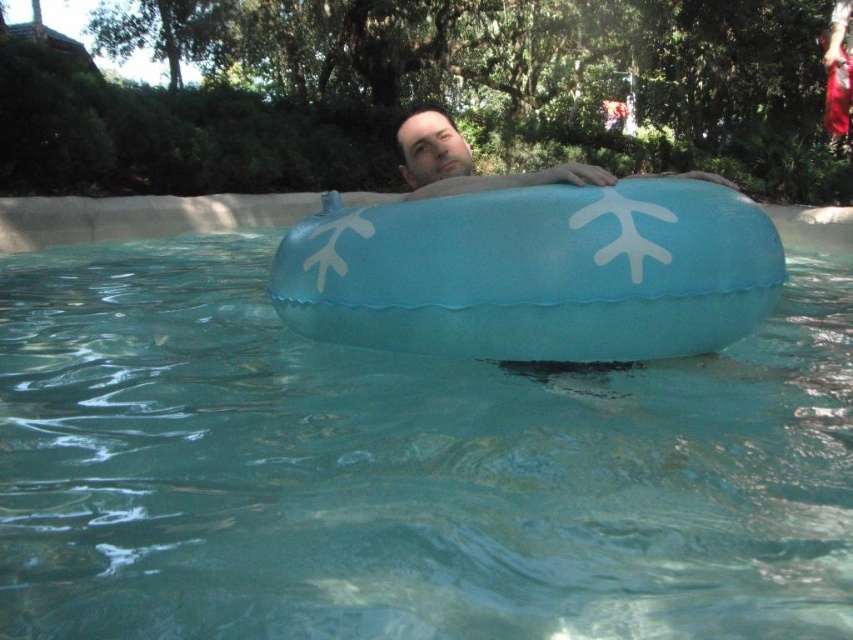
Who is shorter, blue rubber ring at center or matte blue float at center?

With less height is blue rubber ring at center.

What do you see at coordinates (403, 470) in the screenshot? I see `blue rubber ring at center` at bounding box center [403, 470].

You are a GUI agent. You are given a task and a screenshot of the screen. Output one action in this format:
    pyautogui.click(x=<x>, y=<y>)
    Task: Click on the blue rubber ring at center
    Image resolution: width=853 pixels, height=640 pixels.
    Given the screenshot: What is the action you would take?
    pyautogui.click(x=403, y=470)